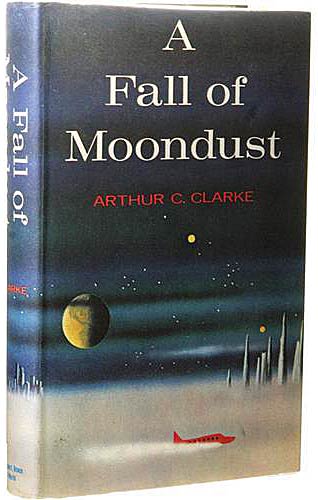
This screenshot has width=318, height=500. What are the coordinates of `cover of book` in the screenshot? It's located at (277, 217).